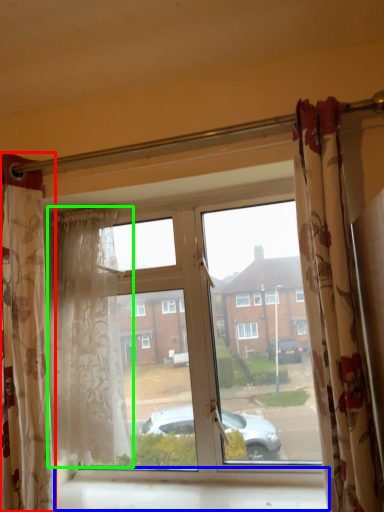
Question: Which object is positioned closest to curtain (highlighted by a red box)? Select from window sill (highlighted by a blue box) and curtain (highlighted by a green box).

Choices:
 (A) window sill
 (B) curtain

Answer: (B)